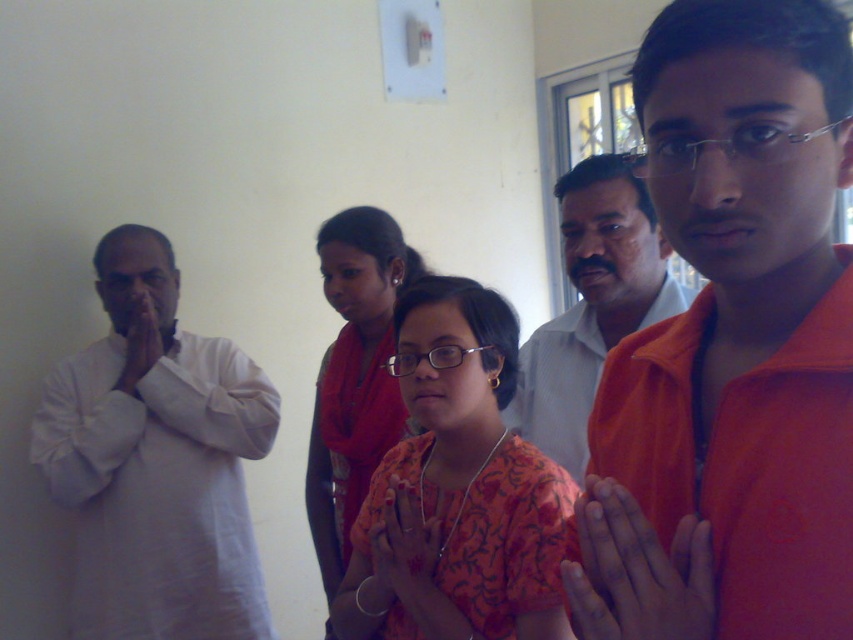
Is orange printed dress at center positioned at the back of matte white shirt at center?

No, it is not.

Find the location of a particular element. Image resolution: width=853 pixels, height=640 pixels. orange printed dress at center is located at coordinates (457, 490).

This screenshot has width=853, height=640. Find the location of `orange printed dress at center`. orange printed dress at center is located at coordinates (457, 490).

Is white cotton kurta at left wider than orange printed sari at center?

Indeed, white cotton kurta at left has a greater width compared to orange printed sari at center.

Can you confirm if white cotton kurta at left is shorter than orange printed sari at center?

No, white cotton kurta at left is not shorter than orange printed sari at center.

Describe the element at coordinates (155, 460) in the screenshot. The width and height of the screenshot is (853, 640). I see `white cotton kurta at left` at that location.

I want to click on white cotton kurta at left, so click(x=155, y=460).

Is orange printed dress at center above orange printed sari at center?

No.

Does point (469, 282) come behind point (383, 216)?

No.

Between point (433, 435) and point (341, 260), which one is positioned behind?

Point (341, 260)

Locate an element on the screen. orange printed dress at center is located at coordinates (457, 490).